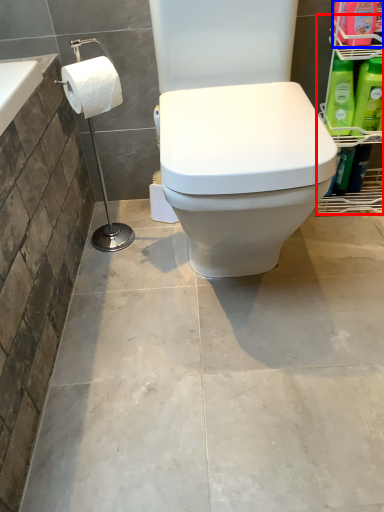
Question: Which object appears farthest to the camera in this image, shelf (highlighted by a red box) or cleaning product (highlighted by a blue box)?

Choices:
 (A) shelf
 (B) cleaning product

Answer: (B)